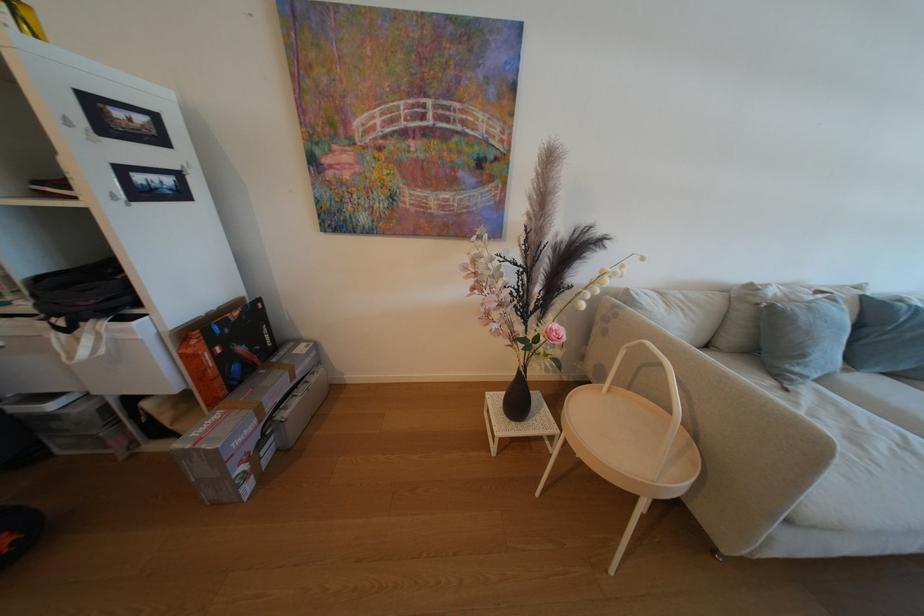
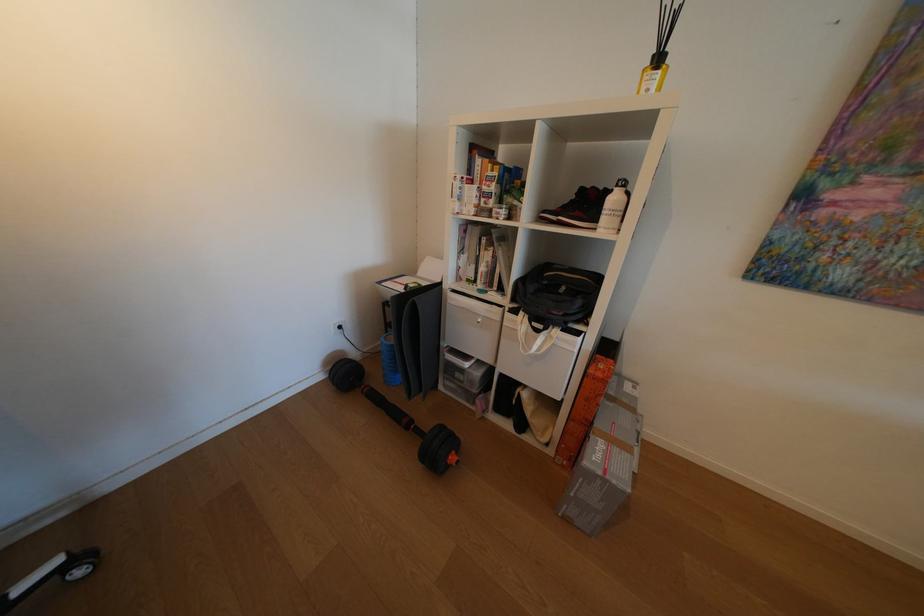
Where in the second image is the point corresponding to [49,185] from the first image?

(554, 213)